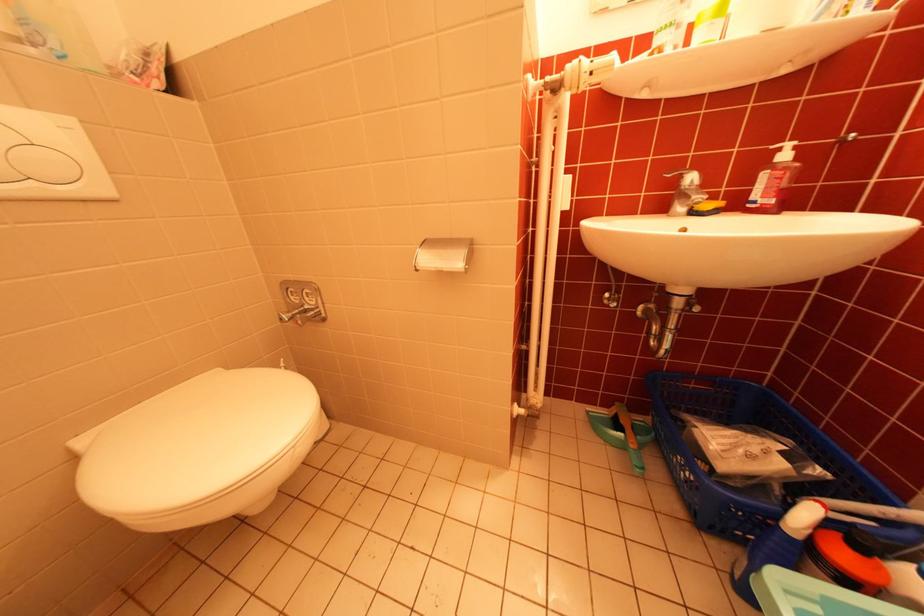
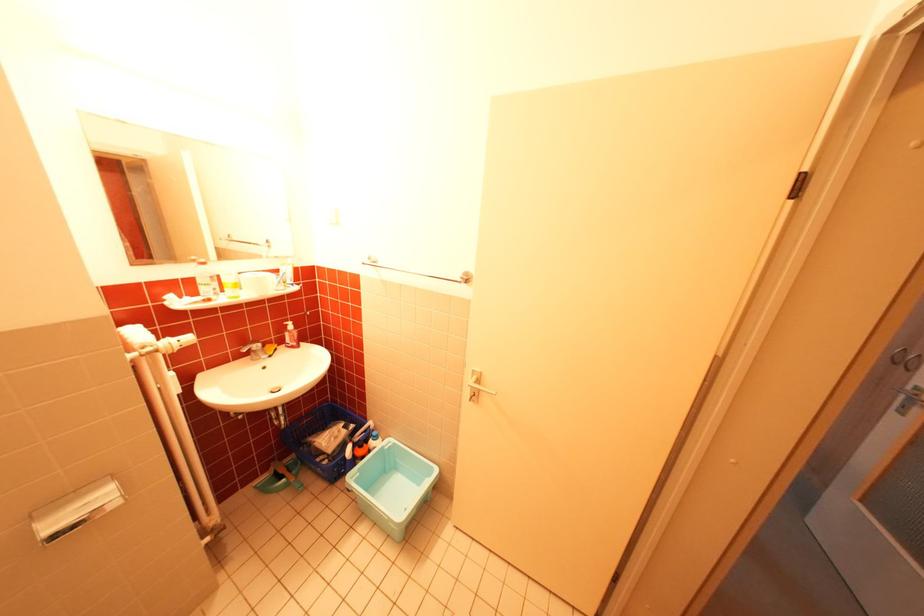
Where in the second image is the point corresponding to point 628,405 from the first image?

(283, 464)